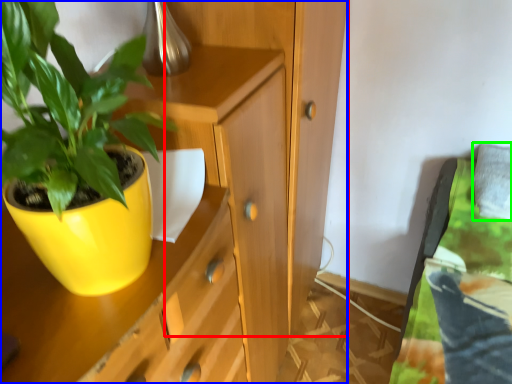
Question: Based on their relative distances, which object is farther from dresser (highlighted by a red box)? Choose from cabinetry (highlighted by a blue box) and pillow (highlighted by a green box).

Choices:
 (A) cabinetry
 (B) pillow

Answer: (B)